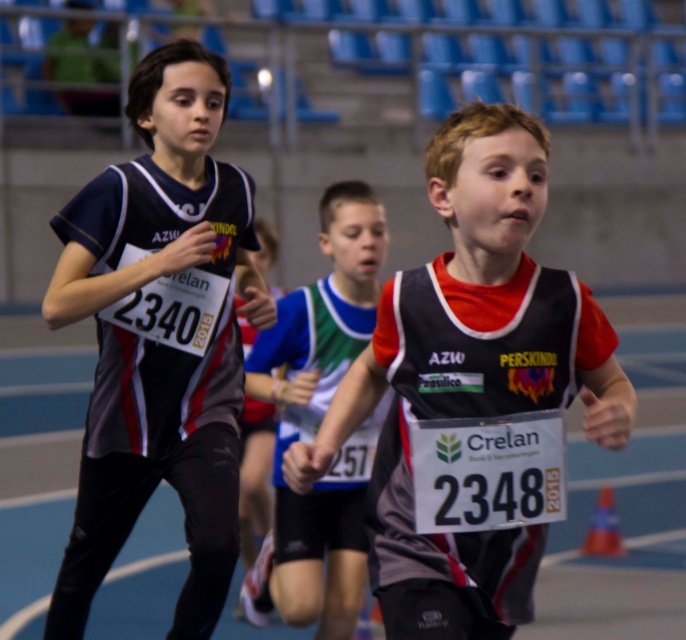
Question: Is matte black jersey at center positioned at the back of matte black vest at center?

Choices:
 (A) yes
 (B) no

Answer: (A)

Question: Which object is the closest to the matte black vest at center?

Choices:
 (A) white fabric shirt at center
 (B) matte black jersey at center

Answer: (B)

Question: Does matte black jersey at center lie in front of white fabric shirt at center?

Choices:
 (A) no
 (B) yes

Answer: (B)

Question: Which point is farther from the camera taking this photo?

Choices:
 (A) (167, 289)
 (B) (488, 280)

Answer: (A)

Question: Which point is farther to the camera?

Choices:
 (A) (390, 611)
 (B) (255, 604)
 (C) (177, 257)

Answer: (B)

Question: Is matte black jersey at center thinner than matte black vest at center?

Choices:
 (A) no
 (B) yes

Answer: (B)